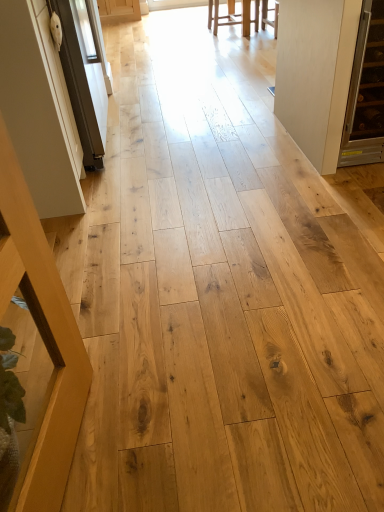
Question: Is white glossy screen door at left further to camera compared to light brown wood stool at upper center, which ranks as the first furniture in back-to-front order?

Choices:
 (A) yes
 (B) no

Answer: (B)

Question: From the image's perspective, is white glossy screen door at left located above light brown wood stool at upper center, the first furniture positioned from the top?

Choices:
 (A) yes
 (B) no

Answer: (B)

Question: Is white glossy screen door at left aimed at light brown wood stool at upper center, which ranks as the first furniture in back-to-front order?

Choices:
 (A) yes
 (B) no

Answer: (B)

Question: Can you confirm if white glossy screen door at left is thinner than light brown wood stool at upper center, which is the 2th furniture in front-to-back order?

Choices:
 (A) no
 (B) yes

Answer: (B)

Question: From a real-world perspective, does white glossy screen door at left sit lower than light brown wood stool at upper center, the first furniture positioned from the top?

Choices:
 (A) no
 (B) yes

Answer: (A)

Question: Based on their positions, is white matte door at right located to the left or right of white glossy screen door at left?

Choices:
 (A) right
 (B) left

Answer: (A)

Question: Considering the positions of white matte door at right and white glossy screen door at left in the image, is white matte door at right wider or thinner than white glossy screen door at left?

Choices:
 (A) wide
 (B) thin

Answer: (A)

Question: From a real-world perspective, is white matte door at right positioned above or below white glossy screen door at left?

Choices:
 (A) below
 (B) above

Answer: (A)

Question: Is white matte door at right taller or shorter than white glossy screen door at left?

Choices:
 (A) short
 (B) tall

Answer: (A)

Question: Is light brown wood stool at upper center, which ranks as the first furniture in back-to-front order, taller or shorter than white matte door at right?

Choices:
 (A) short
 (B) tall

Answer: (A)

Question: Considering the positions of point (233, 22) and point (309, 76), is point (233, 22) closer or farther from the camera than point (309, 76)?

Choices:
 (A) closer
 (B) farther

Answer: (B)

Question: Looking at their shapes, would you say light brown wood stool at upper center, the second furniture positioned from the bottom, is wider or thinner than white matte door at right?

Choices:
 (A) thin
 (B) wide

Answer: (A)

Question: Based on their positions, is light brown wood stool at upper center, which is the 2th furniture in front-to-back order, located to the left or right of white matte door at right?

Choices:
 (A) right
 (B) left

Answer: (B)

Question: Is white glossy screen door at left bigger or smaller than white matte door at right?

Choices:
 (A) big
 (B) small

Answer: (B)

Question: Choose the correct answer: Is white glossy screen door at left inside white matte door at right or outside it?

Choices:
 (A) inside
 (B) outside

Answer: (B)